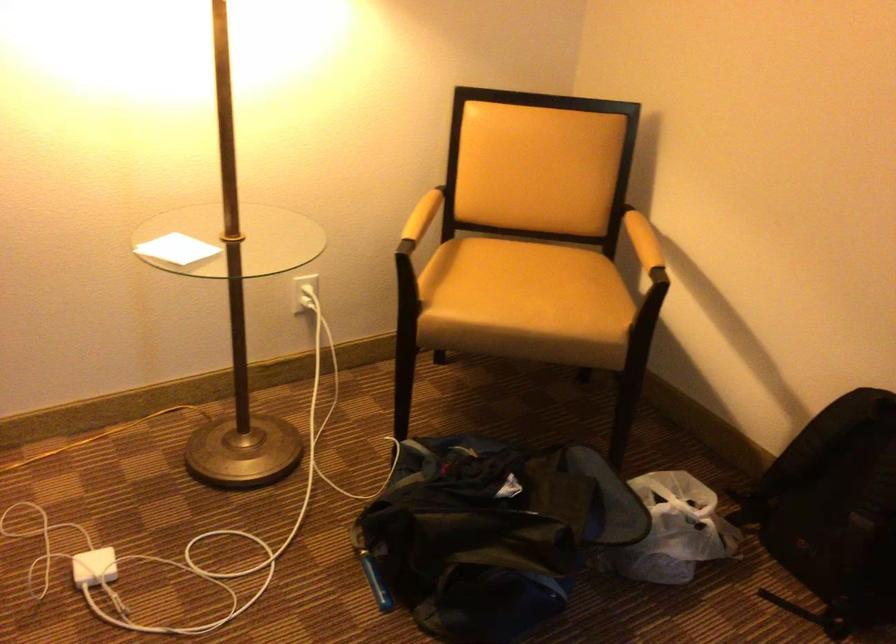
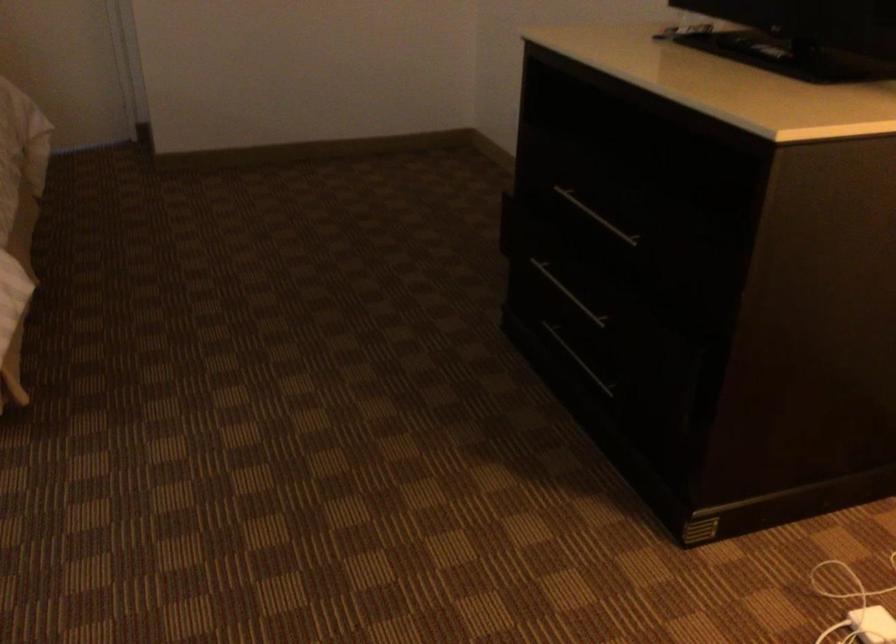
In the second image, find the point that corresponds to (x=84, y=576) in the first image.

(872, 625)